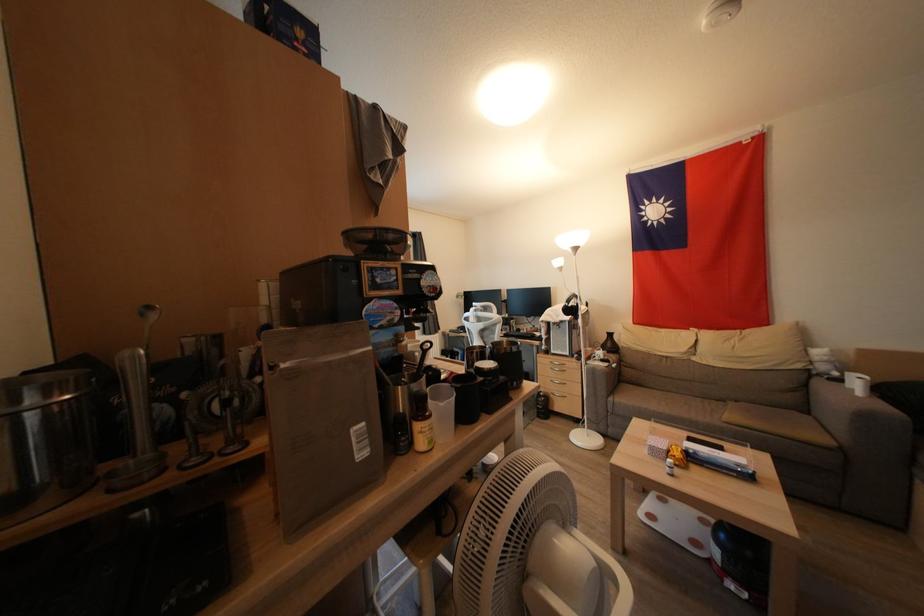
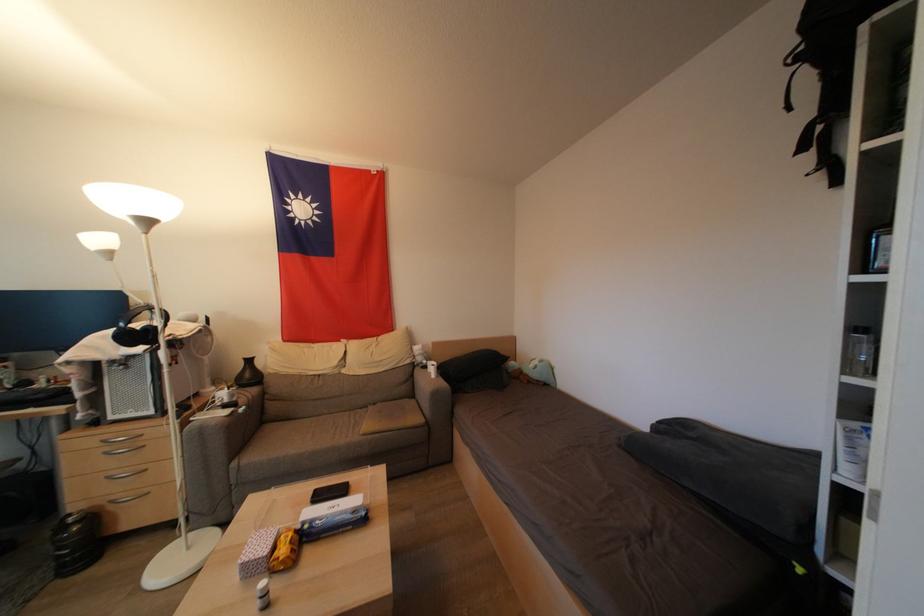
Find the pixel in the second image that matches pixel 673 455 in the first image.

(277, 553)